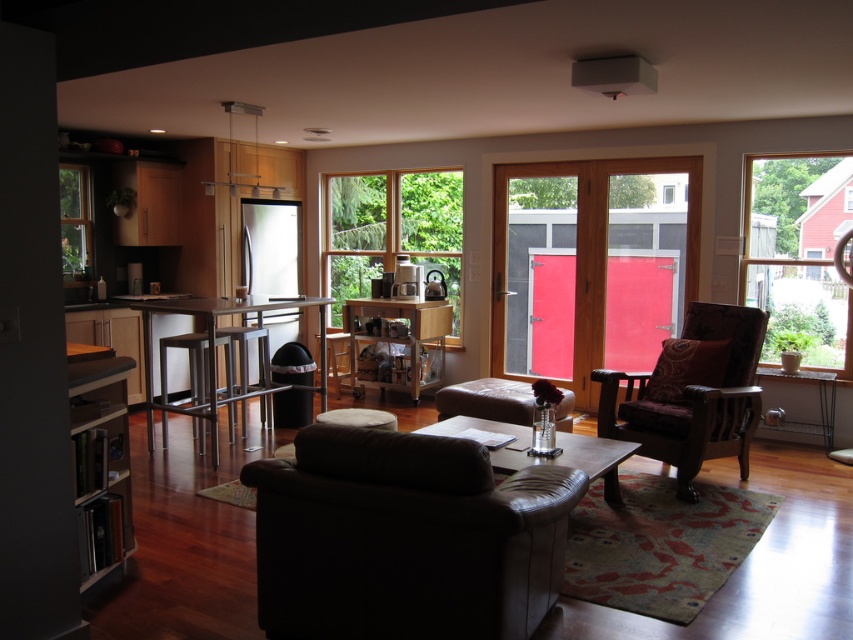
Is leather couch at center taller than red glass door at center?

Incorrect, leather couch at center's height is not larger of red glass door at center's.

Is leather couch at center closer to the viewer compared to red glass door at center?

Yes, leather couch at center is closer to the viewer.

Is point (572, 496) positioned behind point (602, 321)?

No, it is in front of (602, 321).

Where is `leather couch at center`? leather couch at center is located at coordinates (404, 538).

Is red glass door at center above clear glass window at upper left?

Incorrect, red glass door at center is not positioned above clear glass window at upper left.

Can you confirm if red glass door at center is thinner than clear glass window at upper left?

No.

Is point (506, 202) closer to viewer compared to point (73, 236)?

No, (506, 202) is further to viewer.

Locate an element on the screen. The height and width of the screenshot is (640, 853). red glass door at center is located at coordinates (590, 266).

Is red glass door at center below wooden bookshelf at left?

Incorrect, red glass door at center is not positioned below wooden bookshelf at left.

Who is more forward, (531,288) or (83,433)?

Answer: Point (83,433)

Find the location of `red glass door at center`. red glass door at center is located at coordinates (590, 266).